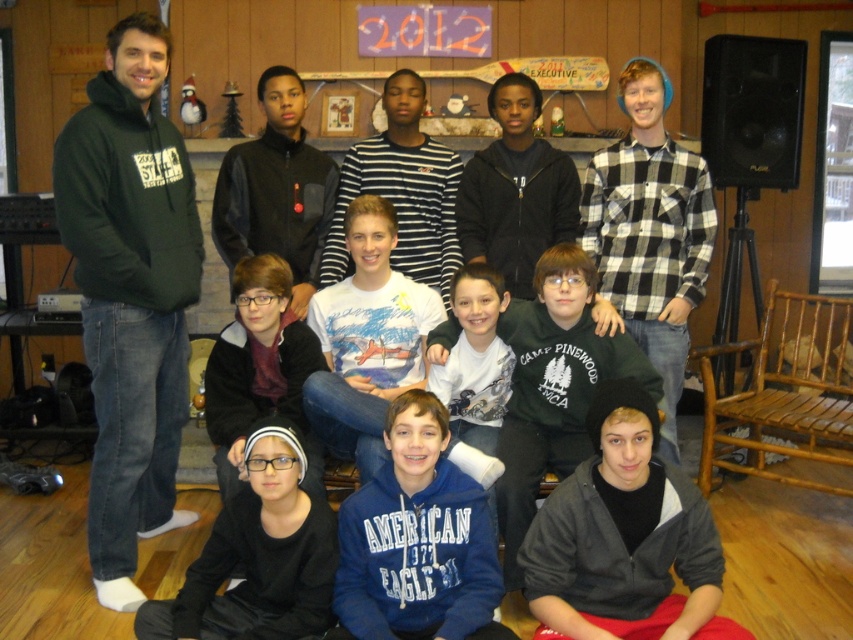
Does black matte hoodie at lower left have a greater height compared to green fleece sweatshirt at center?

No, black matte hoodie at lower left is not taller than green fleece sweatshirt at center.

Based on the photo, is black matte hoodie at lower left positioned behind green fleece sweatshirt at center?

No, it is not.

Is point (318, 563) behind point (532, 433)?

That is False.

This screenshot has width=853, height=640. I want to click on black matte hoodie at lower left, so click(x=258, y=556).

Is point (663, 465) positioned in front of point (289, 579)?

No, it is not.

This screenshot has height=640, width=853. Find the location of `gray fleece jacket at lower right`. gray fleece jacket at lower right is located at coordinates (624, 538).

Identify the location of gray fleece jacket at lower right. The image size is (853, 640). (624, 538).

Can you confirm if green fleece sweatshirt at center is smaller than white printed t-shirt at center?

Actually, green fleece sweatshirt at center might be larger than white printed t-shirt at center.

Does point (529, 456) come farther from viewer compared to point (331, 384)?

No.

Where is `green fleece sweatshirt at center`? This screenshot has width=853, height=640. green fleece sweatshirt at center is located at coordinates (553, 387).